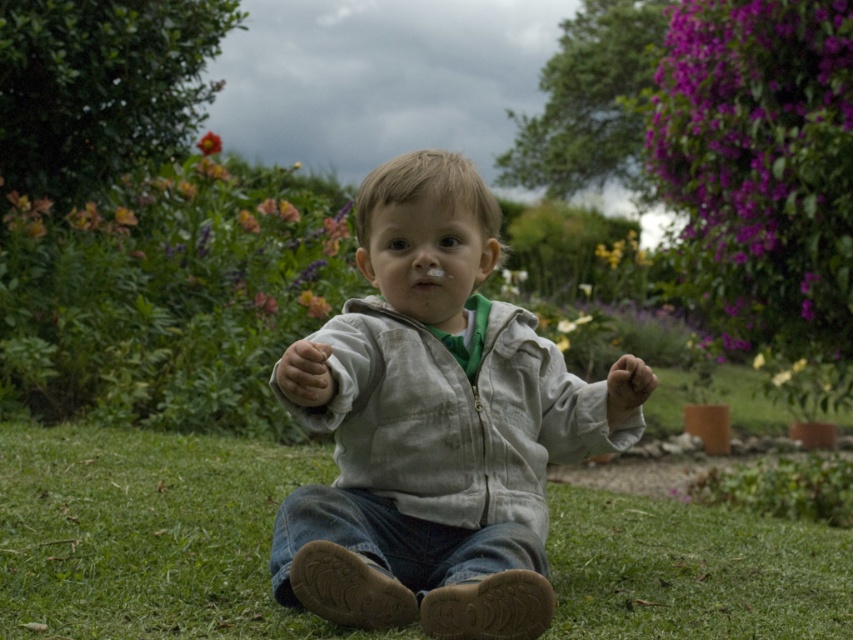
You are a gardener who wants to plant a new flower between the green grass at center and the smooth yellow flower at upper left. Based on their positions, where should the new flower be placed?

The green grass at center is in front of the smooth yellow flower at upper left, so the new flower should be placed between them, closer to the green grass at center to maintain the spatial arrangement.

You are a gardener who wants to plant a new flower in the garden. You have a green grass at center and a smooth yellow flower at upper left. Which object is located below the other?

The green grass at center is positioned under the smooth yellow flower at upper left, so the green grass at center is below the smooth yellow flower at upper left.